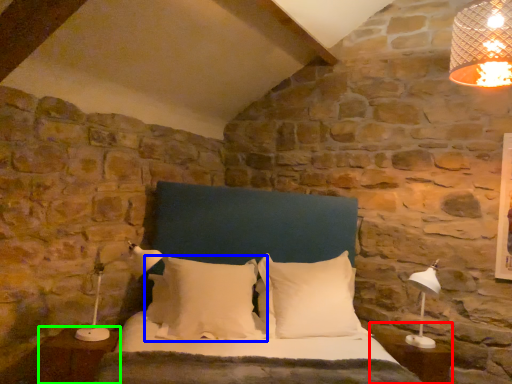
Question: Which is nearer to the side table (highlighted by a red box)? pillow (highlighted by a blue box) or nightstand (highlighted by a green box).

Choices:
 (A) pillow
 (B) nightstand

Answer: (A)